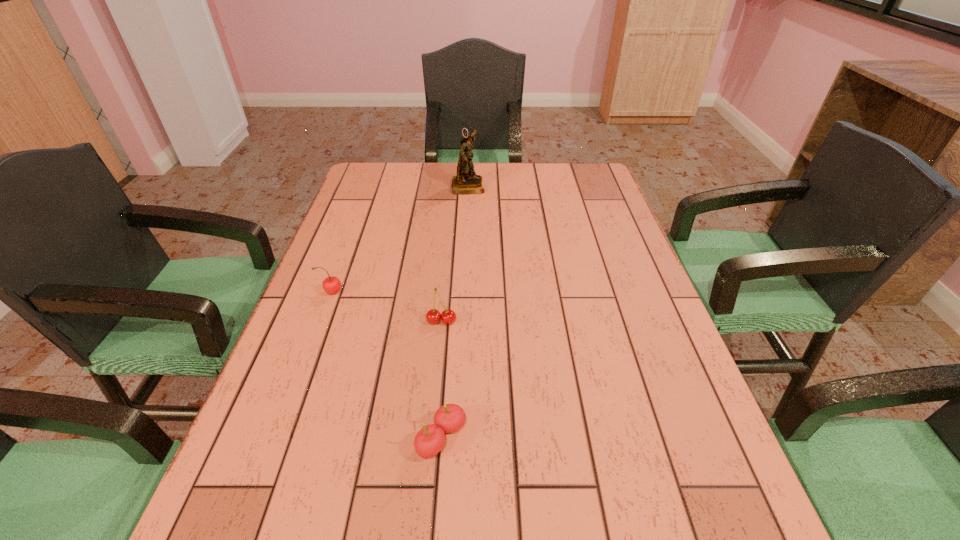
This screenshot has width=960, height=540. I want to click on object that is at the far edge, so click(x=466, y=182).

Locate an element on the screen. This screenshot has width=960, height=540. object located at the left edge is located at coordinates (331, 285).

Locate an element on the screen. This screenshot has width=960, height=540. free space at the far edge of the desktop is located at coordinates (538, 163).

Locate an element on the screen. free space at the left edge of the desktop is located at coordinates (379, 257).

In order to click on vacant position at the right edge of the desktop in this screenshot , I will do `click(646, 367)`.

The width and height of the screenshot is (960, 540). In the image, there is a desktop. Identify the location of vacant space at the far left corner. (368, 174).

Where is `free space at the far right corner`? The width and height of the screenshot is (960, 540). free space at the far right corner is located at coordinates (563, 166).

This screenshot has height=540, width=960. What are the coordinates of `free space between the second farthest cherry and the nearest object` in the screenshot? It's located at (442, 380).

At what (x,y) coordinates should I click in order to perform the action: click on empty space between the nearest cherry and the leftmost object. Please return your answer as a coordinate pair (x, y). The width and height of the screenshot is (960, 540). Looking at the image, I should click on (387, 365).

Where is `free space between the nearest cherry and the second nearest cherry`? The width and height of the screenshot is (960, 540). free space between the nearest cherry and the second nearest cherry is located at coordinates (442, 380).